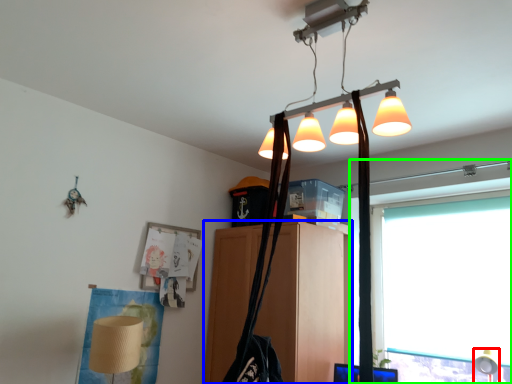
Question: Which is farther away from table lamp (highlighted by a red box)? furniture (highlighted by a blue box) or window (highlighted by a green box)?

Choices:
 (A) furniture
 (B) window

Answer: (A)